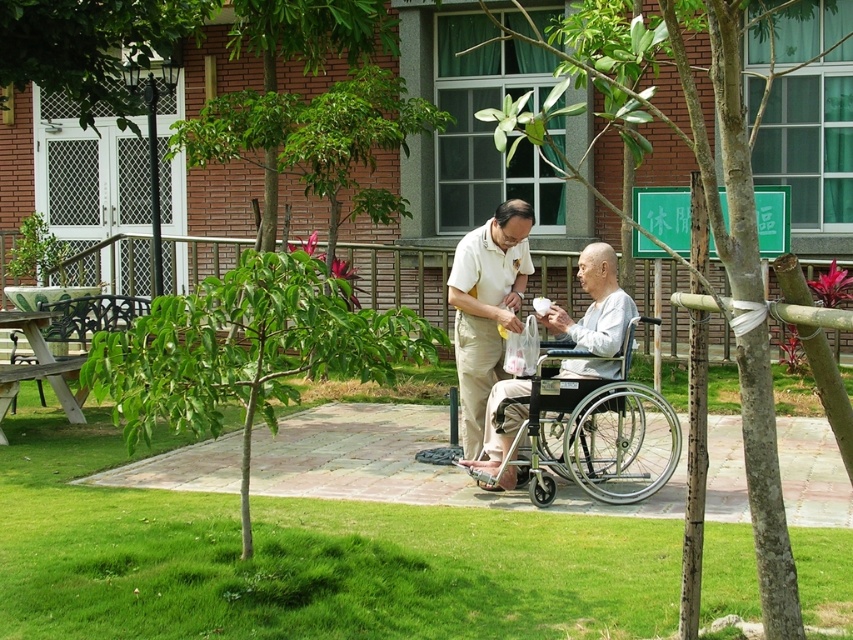
Question: Which is farther from the green leafy tree at center?

Choices:
 (A) white matte shirt at center
 (B) silver metallic wheelchair at lower center

Answer: (A)

Question: Which point appears farthest from the camera in this image?

Choices:
 (A) (473, 394)
 (B) (769, 522)

Answer: (A)

Question: Among these points, which one is nearest to the camera?

Choices:
 (A) (756, 376)
 (B) (524, 218)

Answer: (A)

Question: Is green leafy tree at center in front of white matte shirt at center?

Choices:
 (A) yes
 (B) no

Answer: (A)

Question: Can you confirm if green leafy tree at center is positioned above silver metallic wheelchair at lower center?

Choices:
 (A) no
 (B) yes

Answer: (B)

Question: Can you confirm if green leafy tree at center is thinner than white matte shirt at center?

Choices:
 (A) yes
 (B) no

Answer: (B)